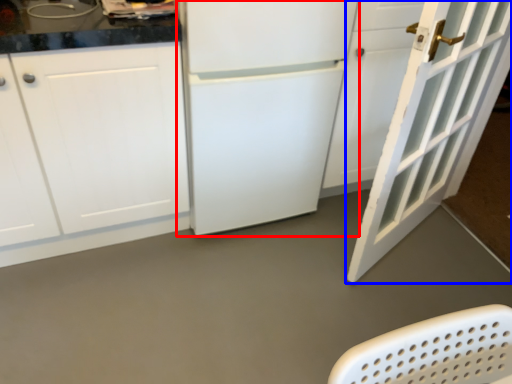
Question: Among these objects, which one is nearest to the camera, refrigerator (highlighted by a red box) or door (highlighted by a blue box)?

Choices:
 (A) refrigerator
 (B) door

Answer: (B)